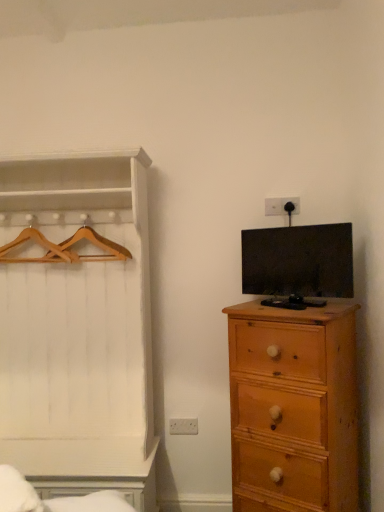
Question: Is matte black tv at right bigger or smaller than white wood dresser at left?

Choices:
 (A) big
 (B) small

Answer: (B)

Question: From the image's perspective, is matte black tv at right above or below white wood dresser at left?

Choices:
 (A) above
 (B) below

Answer: (A)

Question: Based on their relative distances, which object is farther from the white wood dresser at left?

Choices:
 (A) wooden hanger at left, which is counted as the 2th hanger, starting from the right
 (B) wooden hangers at left, which appears as the 1th hanger when viewed from the right
 (C) light brown wooden chest of drawers at right
 (D) matte black tv at right

Answer: (D)

Question: Which is nearer to the white wood dresser at left?

Choices:
 (A) matte black tv at right
 (B) light brown wooden chest of drawers at right
 (C) wooden hanger at left, which is counted as the 2th hanger, starting from the right
 (D) wooden hangers at left, which appears as the 1th hanger when viewed from the right

Answer: (D)